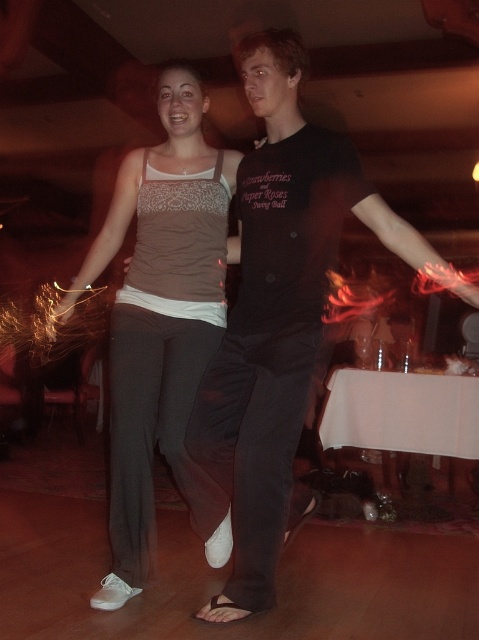
Question: Is black cotton shirt at center below matte gray tank top at center?

Choices:
 (A) no
 (B) yes

Answer: (A)

Question: Is black cotton shirt at center below matte gray tank top at center?

Choices:
 (A) no
 (B) yes

Answer: (A)

Question: Among these objects, which one is farthest from the camera?

Choices:
 (A) matte gray tank top at center
 (B) black cotton shirt at center

Answer: (A)

Question: Which point is closer to the camera?

Choices:
 (A) black cotton shirt at center
 (B) matte gray tank top at center

Answer: (A)

Question: Is black cotton shirt at center further to the viewer compared to matte gray tank top at center?

Choices:
 (A) yes
 (B) no

Answer: (B)